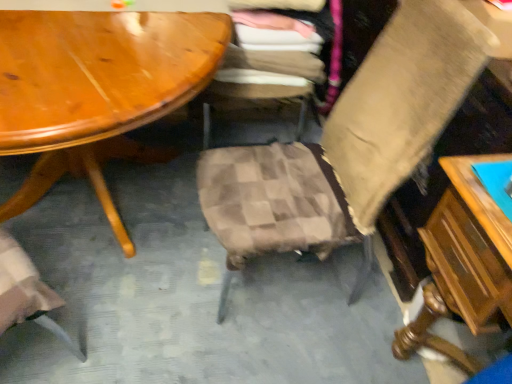
Describe the element at coordinates (268, 63) in the screenshot. I see `plaid fabric chair at center, which is counted as the first chair, starting from the left` at that location.

In order to click on wooden table at right in this screenshot , I will do `click(463, 264)`.

What do you see at coordinates (351, 140) in the screenshot? The width and height of the screenshot is (512, 384). I see `beige fabric chair at center, marked as the 2th chair in a left-to-right arrangement` at bounding box center [351, 140].

Where is `plaid fabric chair at center, which is the second chair from right to left`? The image size is (512, 384). plaid fabric chair at center, which is the second chair from right to left is located at coordinates (268, 63).

Who is shorter, plaid fabric chair at center, which is counted as the first chair, starting from the left, or beige fabric chair at center, marked as the 2th chair in a left-to-right arrangement?

plaid fabric chair at center, which is counted as the first chair, starting from the left, is shorter.

Is plaid fabric chair at center, which is the second chair from right to left, inside or outside of beige fabric chair at center, marked as the 2th chair in a left-to-right arrangement?

plaid fabric chair at center, which is the second chair from right to left, is not enclosed by beige fabric chair at center, marked as the 2th chair in a left-to-right arrangement.

How distant is plaid fabric chair at center, which is counted as the first chair, starting from the left, from beige fabric chair at center, marked as the 2th chair in a left-to-right arrangement?

plaid fabric chair at center, which is counted as the first chair, starting from the left, and beige fabric chair at center, marked as the 2th chair in a left-to-right arrangement, are 19.23 inches apart from each other.

You are a GUI agent. You are given a task and a screenshot of the screen. Output one action in this format:
    pyautogui.click(x=<x>, y=<y>)
    Task: Click on the chair positioned vertically above the beige fabric chair at center, marked as the 2th chair in a left-to-right arrangement (from a real-world perspective)
    This screenshot has height=384, width=512.
    Given the screenshot: What is the action you would take?
    pyautogui.click(x=268, y=63)

From the picture: Considering the positions of objects wooden table at right and plaid fabric chair at center, which is counted as the first chair, starting from the left, in the image provided, who is more to the left, wooden table at right or plaid fabric chair at center, which is counted as the first chair, starting from the left,?

Positioned to the left is plaid fabric chair at center, which is counted as the first chair, starting from the left.

Is wooden table at right facing towards plaid fabric chair at center, which is counted as the first chair, starting from the left?

No, wooden table at right is not facing towards plaid fabric chair at center, which is counted as the first chair, starting from the left.

Are wooden table at right and plaid fabric chair at center, which is the second chair from right to left, making contact?

No, wooden table at right is not with plaid fabric chair at center, which is the second chair from right to left.

Which object is positioned more to the right, plaid fabric chair at center, which is the second chair from right to left, or wooden table at right?

wooden table at right.

Starting from the wooden table at right, which chair is the 2nd one to the left? Please provide its 2D coordinates.

[(268, 63)]

Does plaid fabric chair at center, which is the second chair from right to left, have a lesser height compared to wooden table at right?

No.

Does point (307, 185) appear closer or farther from the camera than point (256, 49)?

Point (307, 185) appears to be closer to the viewer than point (256, 49).

Considering the positions of objects beige fabric chair at center, the first chair viewed from the right, and plaid fabric chair at center, which is the second chair from right to left, in the image provided, who is behind, beige fabric chair at center, the first chair viewed from the right, or plaid fabric chair at center, which is the second chair from right to left,?

Positioned behind is plaid fabric chair at center, which is the second chair from right to left.

In terms of size, does beige fabric chair at center, the first chair viewed from the right, appear bigger or smaller than plaid fabric chair at center, which is counted as the first chair, starting from the left?

In the image, beige fabric chair at center, the first chair viewed from the right, appears to be larger than plaid fabric chair at center, which is counted as the first chair, starting from the left.

What's the angular difference between beige fabric chair at center, marked as the 2th chair in a left-to-right arrangement, and wooden table at right's facing directions?

The angle between the facing direction of beige fabric chair at center, marked as the 2th chair in a left-to-right arrangement, and the facing direction of wooden table at right is 0.237 degrees.

Could you tell me if beige fabric chair at center, the first chair viewed from the right, is facing wooden table at right?

No, beige fabric chair at center, the first chair viewed from the right, is not aimed at wooden table at right.

Is beige fabric chair at center, marked as the 2th chair in a left-to-right arrangement, behind wooden table at right?

Yes, the depth of beige fabric chair at center, marked as the 2th chair in a left-to-right arrangement, is greater than that of wooden table at right.

From the image's perspective, is beige fabric chair at center, marked as the 2th chair in a left-to-right arrangement, on top of wooden table at right?

Yes, from the image's perspective, beige fabric chair at center, marked as the 2th chair in a left-to-right arrangement, is over wooden table at right.

Based on the photo, from a real-world perspective, is wooden table at right beneath beige fabric chair at center, marked as the 2th chair in a left-to-right arrangement?

Indeed, from a real-world perspective, wooden table at right is positioned beneath beige fabric chair at center, marked as the 2th chair in a left-to-right arrangement.

Considering their positions, is wooden table at right located in front of or behind beige fabric chair at center, marked as the 2th chair in a left-to-right arrangement?

In the image, wooden table at right appears in front of beige fabric chair at center, marked as the 2th chair in a left-to-right arrangement.

Is wooden table at right positioned far away from beige fabric chair at center, the first chair viewed from the right?

Actually, wooden table at right and beige fabric chair at center, the first chair viewed from the right, are a little close together.

Is wooden table at right turned away from beige fabric chair at center, the first chair viewed from the right?

No.

Find the location of `chair above the beige fabric chair at center, the first chair viewed from the right (from a real-world perspective)`. chair above the beige fabric chair at center, the first chair viewed from the right (from a real-world perspective) is located at coordinates (268, 63).

Where is `chair that is the 2nd one when counting backward from the wooden table at right`? This screenshot has height=384, width=512. chair that is the 2nd one when counting backward from the wooden table at right is located at coordinates (268, 63).

When comparing their distances from plaid fabric chair at center, which is the second chair from right to left, does beige fabric chair at center, the first chair viewed from the right, or wooden table at right seem closer?

Based on the image, beige fabric chair at center, the first chair viewed from the right, appears to be nearer to plaid fabric chair at center, which is the second chair from right to left.

Based on their spatial positions, is wooden table at right or beige fabric chair at center, marked as the 2th chair in a left-to-right arrangement, closer to plaid fabric chair at center, which is the second chair from right to left?

beige fabric chair at center, marked as the 2th chair in a left-to-right arrangement.

Based on their spatial positions, is beige fabric chair at center, marked as the 2th chair in a left-to-right arrangement, or plaid fabric chair at center, which is the second chair from right to left, closer to wooden table at right?

beige fabric chair at center, marked as the 2th chair in a left-to-right arrangement, lies closer to wooden table at right than the other object.

When comparing their distances from wooden table at right, does plaid fabric chair at center, which is the second chair from right to left, or beige fabric chair at center, marked as the 2th chair in a left-to-right arrangement, seem further?

plaid fabric chair at center, which is the second chair from right to left, lies further to wooden table at right than the other object.

From the image, which object appears to be nearer to beige fabric chair at center, marked as the 2th chair in a left-to-right arrangement, wooden table at right or plaid fabric chair at center, which is the second chair from right to left?

wooden table at right is positioned closer to the anchor beige fabric chair at center, marked as the 2th chair in a left-to-right arrangement.

Which object lies further to the anchor point beige fabric chair at center, the first chair viewed from the right, plaid fabric chair at center, which is the second chair from right to left, or wooden table at right?

Based on the image, plaid fabric chair at center, which is the second chair from right to left, appears to be further to beige fabric chair at center, the first chair viewed from the right.

At what (x,y) coordinates should I click in order to perform the action: click on chair between beige fabric chair at center, marked as the 2th chair in a left-to-right arrangement, and wooden table at right, in the vertical direction. Please return your answer as a coordinate pair (x, y). Looking at the image, I should click on (268, 63).